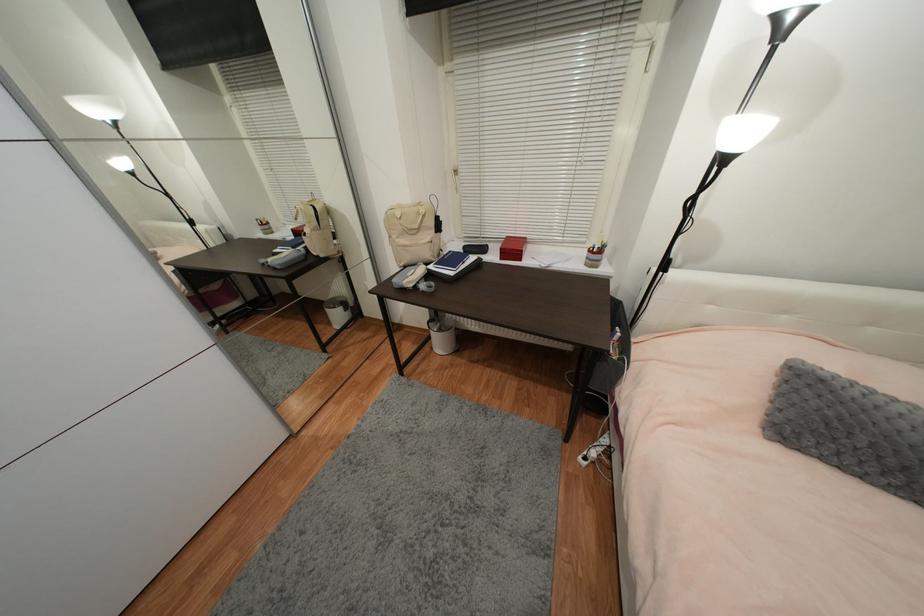
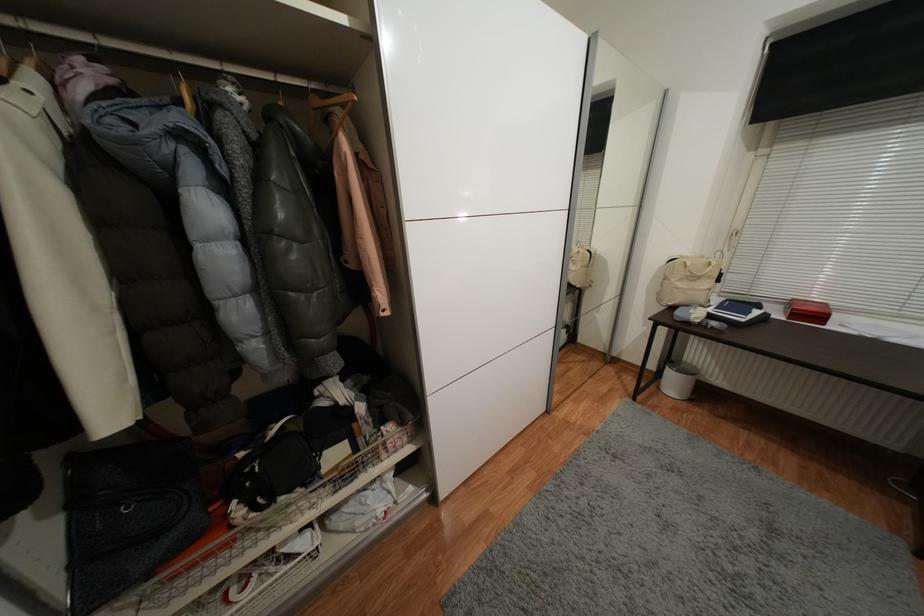
Locate, in the second image, the point that corresponds to (x=332, y=261) in the first image.

(582, 291)